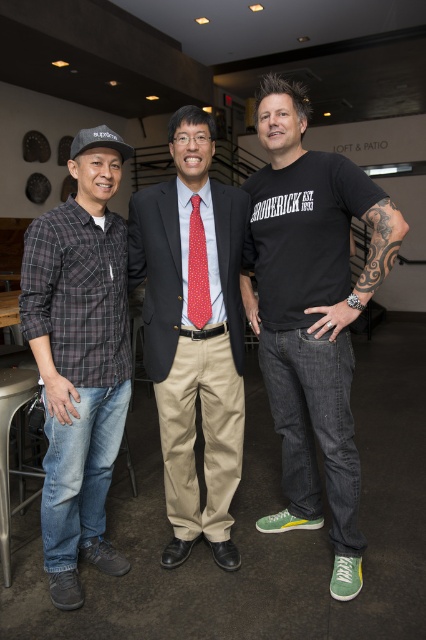
You are standing at the entrance of the venue and want to greet the central figure. The central figure is located at point (198, 198). However, there is another person at point (103, 244). Will you need to walk around them to reach the central figure?

Point (103, 244) is in front of point (198, 198), so yes, you will need to walk around them to reach the central figure.

Where is the plaid cotton shirt at left located in the image?

The plaid cotton shirt at left is located at point (80,356).